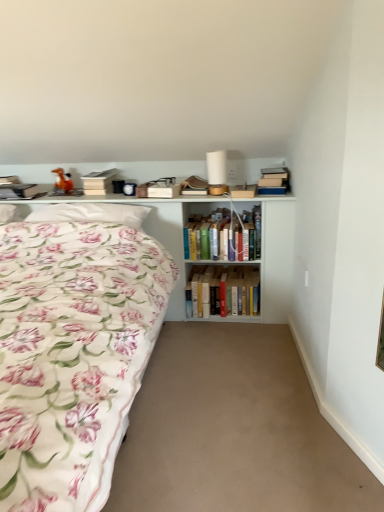
At what (x,y) coordinates should I click in order to perform the action: click on floral fabric bed at left. Please return your answer as a coordinate pair (x, y). Looking at the image, I should click on (73, 353).

The height and width of the screenshot is (512, 384). In order to click on hardcover book at upper right, marked as the 3th book in a bottom-to-top arrangement in this screenshot , I will do `click(274, 181)`.

What do you see at coordinates (233, 430) in the screenshot? Image resolution: width=384 pixels, height=512 pixels. I see `beige carpet at center` at bounding box center [233, 430].

This screenshot has height=512, width=384. Describe the element at coordinates (219, 237) in the screenshot. I see `hardcover books at center, the 2th book positioned from the bottom` at that location.

This screenshot has width=384, height=512. I want to click on orange matte toy horse at upper left, so click(62, 181).

Looking at their sizes, would you say floral fabric bed at left is wider or thinner than hardcover book at upper right, which appears as the first book when viewed from the top?

floral fabric bed at left is wider than hardcover book at upper right, which appears as the first book when viewed from the top.

Is hardcover book at upper right, marked as the 3th book in a bottom-to-top arrangement, a part of floral fabric bed at left?

No, hardcover book at upper right, marked as the 3th book in a bottom-to-top arrangement, is not inside floral fabric bed at left.

Which is more to the right, floral fabric bed at left or hardcover book at upper right, marked as the 3th book in a bottom-to-top arrangement?

Positioned to the right is hardcover book at upper right, marked as the 3th book in a bottom-to-top arrangement.

Considering the relative sizes of floral fabric bed at left and hardcover book at upper right, marked as the 3th book in a bottom-to-top arrangement, in the image provided, is floral fabric bed at left smaller than hardcover book at upper right, marked as the 3th book in a bottom-to-top arrangement,?

No.

Is beige carpet at center not inside white soft pillow at upper left?

Yes, beige carpet at center is not within white soft pillow at upper left.

In the scene shown: Is beige carpet at center positioned with its back to white soft pillow at upper left?

No.

Which is closer to the camera, (231, 375) or (56, 212)?

The point (231, 375) is closer to the camera.

Measure the distance from beige carpet at center to white soft pillow at upper left.

beige carpet at center is 3.49 feet from white soft pillow at upper left.

From the picture: Between hardcover books at center, the 1th book positioned from the bottom, and white wooden shelf at upper left, which one has more height?

Standing taller between the two is white wooden shelf at upper left.

Is hardcover books at center, the 1th book positioned from the bottom, far from white wooden shelf at upper left?

No, hardcover books at center, the 1th book positioned from the bottom, is in close proximity to white wooden shelf at upper left.

From a real-world perspective, which is physically below, hardcover books at center, which is the 3th book from top to bottom, or white wooden shelf at upper left?

In real-world perspective, hardcover books at center, which is the 3th book from top to bottom, is lower.

Is hardcover books at center, the 1th book positioned from the bottom, positioned with its back to white wooden shelf at upper left?

Absolutely, hardcover books at center, the 1th book positioned from the bottom, is directed away from white wooden shelf at upper left.

Is white wooden shelf at upper left with hardcover books at center, the 1th book positioned from the bottom?

white wooden shelf at upper left is not next to hardcover books at center, the 1th book positioned from the bottom, and they're not touching.

From a real-world perspective, is white wooden shelf at upper left positioned over hardcover books at center, the 1th book positioned from the bottom, based on gravity?

Yes, from a real-world perspective, white wooden shelf at upper left is over hardcover books at center, the 1th book positioned from the bottom

Considering the relative positions of white wooden shelf at upper left and hardcover books at center, which is the 3th book from top to bottom, in the image provided, is white wooden shelf at upper left behind hardcover books at center, which is the 3th book from top to bottom,?

No, white wooden shelf at upper left is in front of hardcover books at center, which is the 3th book from top to bottom.

How many degrees apart are the facing directions of white wooden shelf at upper left and hardcover books at center, which is the 3th book from top to bottom?

0.189 degrees.

Which of these two, hardcover books at center, the 1th book positioned from the bottom, or floral fabric bed at left, is smaller?

hardcover books at center, the 1th book positioned from the bottom, is smaller.

Would you say hardcover books at center, which is the 3th book from top to bottom, is to the left or to the right of floral fabric bed at left in the picture?

Based on their positions, hardcover books at center, which is the 3th book from top to bottom, is located to the right of floral fabric bed at left.

Is point (190, 304) farther from camera compared to point (151, 322)?

Yes, it is behind point (151, 322).

Is hardcover books at center, which is the 3th book from top to bottom, oriented towards floral fabric bed at left?

No, hardcover books at center, which is the 3th book from top to bottom, is not turned towards floral fabric bed at left.

Which is in front, point (254, 196) or point (217, 240)?

The point (254, 196) is closer.

Can you confirm if hardcover book at upper center, which is the 3th paperback book in left-to-right order, is smaller than hardcover books at center, the 2th book positioned from the bottom?

Yes, hardcover book at upper center, which is the 3th paperback book in left-to-right order, is smaller than hardcover books at center, the 2th book positioned from the bottom.

From the picture: Which of these two, hardcover book at upper center, which is the 1th paperback book from right to left, or hardcover books at center, the 2th book positioned from the bottom, is wider?

hardcover books at center, the 2th book positioned from the bottom, is wider.

Consider the image. Who is taller, hardcover book at upper center, which is the 3th paperback book in left-to-right order, or hardcover books at center, marked as the 2th book in a top-to-bottom arrangement?

With more height is hardcover books at center, marked as the 2th book in a top-to-bottom arrangement.

Is matte brown paperback book at upper center, arranged as the 2th paperback book when viewed from the left, bigger or smaller than beige carpet at center?

In the image, matte brown paperback book at upper center, arranged as the 2th paperback book when viewed from the left, appears to be smaller than beige carpet at center.

Considering the relative sizes of matte brown paperback book at upper center, arranged as the 2th paperback book when viewed from the left, and beige carpet at center in the image provided, is matte brown paperback book at upper center, arranged as the 2th paperback book when viewed from the left, wider than beige carpet at center?

No, matte brown paperback book at upper center, arranged as the 2th paperback book when viewed from the left, is not wider than beige carpet at center.

Is matte brown paperback book at upper center, arranged as the 2th paperback book when viewed from the left, placed right next to beige carpet at center?

matte brown paperback book at upper center, arranged as the 2th paperback book when viewed from the left, and beige carpet at center are not in contact.

Can you confirm if matte brown paperback book at upper center, which is counted as the second paperback book, starting from the right, is positioned to the right of beige carpet at center?

No.

From the image's perspective, starting from the floral fabric bed at left, which book is the 3rd one above? Please provide its 2D coordinates.

[(274, 181)]

The width and height of the screenshot is (384, 512). What are the coordinates of `plain that is in front of the white soft pillow at upper left` in the screenshot? It's located at (233, 430).

From the image, which object appears to be farther from floral fabric bed at left, beige carpet at center or hardcover books at center, the 1th book positioned from the bottom?

Among the two, hardcover books at center, the 1th book positioned from the bottom, is located further to floral fabric bed at left.

Which object lies further to the anchor point orange matte toy horse at upper left, hardcover books at center, marked as the 2th book in a top-to-bottom arrangement, or hardcover book at upper center, which is the 1th paperback book from right to left?

hardcover book at upper center, which is the 1th paperback book from right to left.

Which object lies further to the anchor point white soft pillow at upper left, hardcover book at upper center, which is the 3th paperback book in left-to-right order, or white wooden shelf at upper left?

The object further to white soft pillow at upper left is hardcover book at upper center, which is the 3th paperback book in left-to-right order.

From the image, which object appears to be farther from matte brown paperback book at upper center, arranged as the 2th paperback book when viewed from the left, white wooden shelf at upper left or hardcover books at center, the 1th book positioned from the bottom?

Among the two, hardcover books at center, the 1th book positioned from the bottom, is located further to matte brown paperback book at upper center, arranged as the 2th paperback book when viewed from the left.

Estimate the real-world distances between objects in this image. Which object is closer to hardcover book at upper center, which is the 1th paperback book from right to left, hardcover book at upper right, marked as the 3th book in a bottom-to-top arrangement, or floral fabric bed at left?

hardcover book at upper right, marked as the 3th book in a bottom-to-top arrangement.

Based on their spatial positions, is hardcover books at center, the 2th book positioned from the bottom, or white soft pillow at upper left closer to hardcover book at upper right, marked as the 3th book in a bottom-to-top arrangement?

hardcover books at center, the 2th book positioned from the bottom.

From the image, which object appears to be farther from hardcover book at upper right, which appears as the first book when viewed from the top, beige carpet at center or hardcover books at center, the 1th book positioned from the bottom?

beige carpet at center is positioned further to the anchor hardcover book at upper right, which appears as the first book when viewed from the top.

Considering their positions, is white matte paperback book at upper center, which is the third paperback book in right-to-left order, positioned further to hardcover books at center, marked as the 2th book in a top-to-bottom arrangement, than white soft pillow at upper left?

The object further to hardcover books at center, marked as the 2th book in a top-to-bottom arrangement, is white matte paperback book at upper center, which is the third paperback book in right-to-left order.

This screenshot has height=512, width=384. Identify the location of pillow between floral fabric bed at left and matte brown paperback book at upper center, arranged as the 2th paperback book when viewed from the left, in the front-back direction. (91, 213).

Find the location of `shelf between orange matte toy horse at upper left and hardcover books at center, the 2th book positioned from the bottom, in the horizontal direction`. shelf between orange matte toy horse at upper left and hardcover books at center, the 2th book positioned from the bottom, in the horizontal direction is located at coordinates (275, 255).

Identify the location of shelf located between beige carpet at center and white matte paperback book at upper center, the 1th paperback book positioned from the left, in the depth direction. The width and height of the screenshot is (384, 512). (275, 255).

This screenshot has width=384, height=512. I want to click on paperback book between hardcover book at upper center, which is the 3th paperback book in left-to-right order, and hardcover books at center, the 1th book positioned from the bottom, vertically, so click(x=159, y=188).